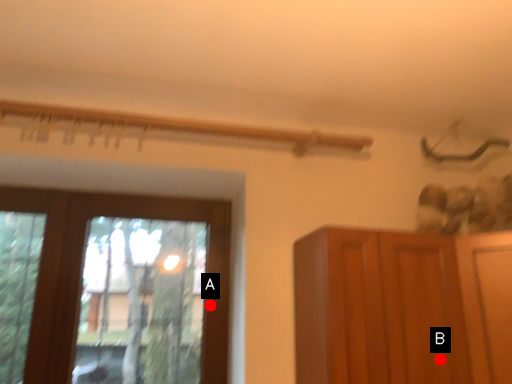
Question: Two points are circled on the image, labeled by A and B beside each circle. Which point is closer to the camera?

Choices:
 (A) A is closer
 (B) B is closer

Answer: (B)